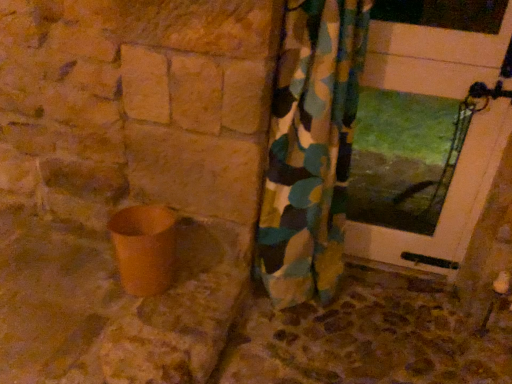
Question: Relative to matte brown pot at lower left, is camouflage fabric curtain at center in front or behind?

Choices:
 (A) front
 (B) behind

Answer: (A)

Question: From the image's perspective, is camouflage fabric curtain at center above or below matte brown pot at lower left?

Choices:
 (A) above
 (B) below

Answer: (A)

Question: Which object is positioned closest to the brown stone concrete at lower center?

Choices:
 (A) matte brown pot at lower left
 (B) camouflage fabric curtain at center
 (C) white glossy door at upper right

Answer: (B)

Question: Estimate the real-world distances between objects in this image. Which object is farther from the camouflage fabric curtain at center?

Choices:
 (A) matte brown pot at lower left
 (B) white glossy door at upper right
 (C) brown stone concrete at lower center

Answer: (A)